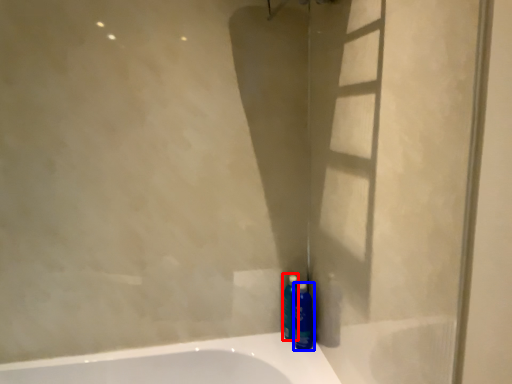
Question: Which object is closer to the camera taking this photo, cleaning product (highlighted by a red box) or mouthwash (highlighted by a blue box)?

Choices:
 (A) cleaning product
 (B) mouthwash

Answer: (B)